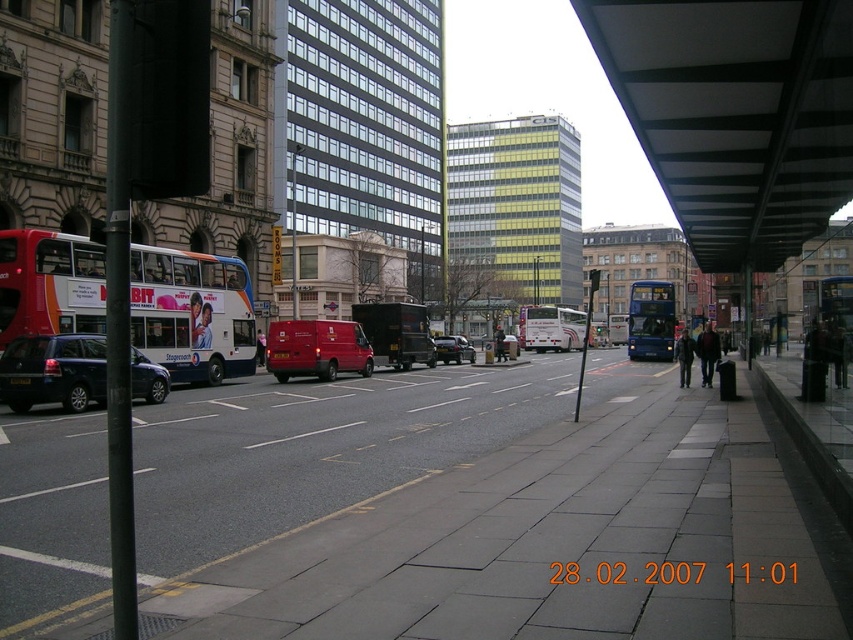
You are a pedestrian standing on the sidewalk next to the dark green pole. You want to cross the street to reach a destination on the opposite side. The road has two lanes. The first lane has the matte blue bus at center and the second lane has the white matte bus at center. Which bus is closer to the curb where you are standing?

The matte blue bus at center is closer to the curb where you are standing because it is positioned on the left side of the white matte bus at center, meaning it is in the first lane which is closer to the sidewalk.

You are standing on the sidewalk near the dark green pole and want to cross the street to reach the blue double decker bus. The crosswalk is located at the point with coordinates closest to the matte black van at center. What are the coordinates of the crosswalk?

The crosswalk is located at the coordinates closest to the matte black van at center, which is at point (396, 333).